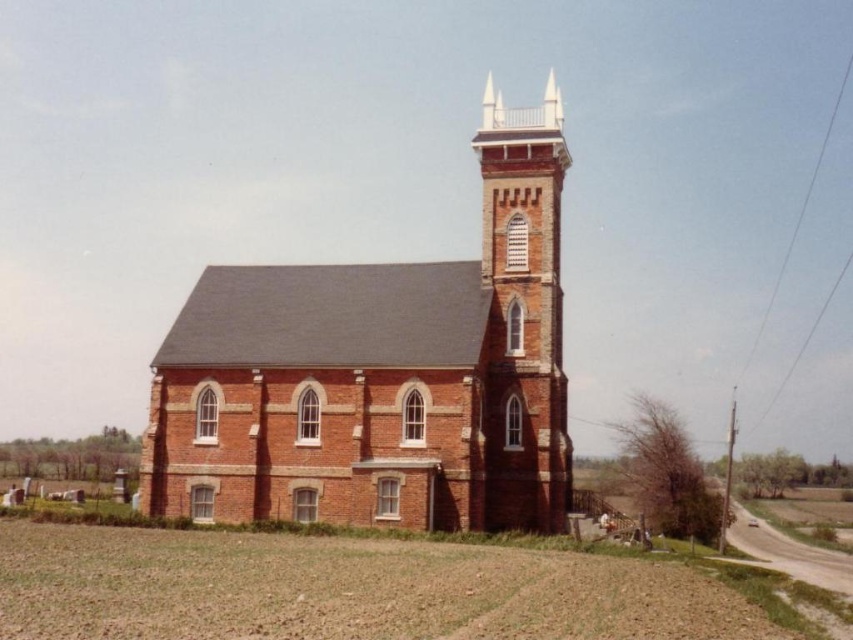
Question: Is the position of brick church at center less distant than that of brick steeple at upper right?

Choices:
 (A) no
 (B) yes

Answer: (B)

Question: Among these points, which one is farthest from the camera?

Choices:
 (A) (331, 448)
 (B) (486, 518)

Answer: (B)

Question: From the image, what is the correct spatial relationship of brick church at center in relation to brick steeple at upper right?

Choices:
 (A) right
 (B) left

Answer: (B)

Question: Does brick church at center appear over brick steeple at upper right?

Choices:
 (A) no
 (B) yes

Answer: (A)